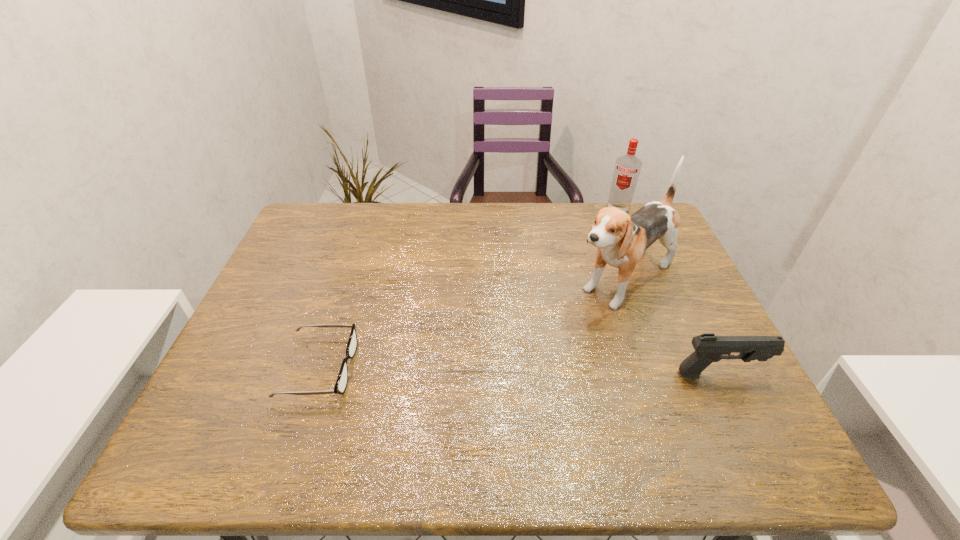
Locate an element on the screen. The image size is (960, 540). free space on the desktop that is between the shortest object and the pistol and is positioned on the front label of the farthest object is located at coordinates (554, 372).

Locate an element on the screen. This screenshot has width=960, height=540. vacant space on the desktop that is between the leftmost object and the second shortest object and is positioned at the face of the third nearest object is located at coordinates (506, 371).